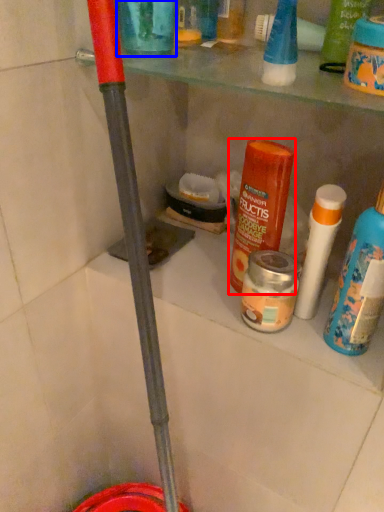
Question: Which point is closer to the camera, product (highlighted by a red box) or product (highlighted by a blue box)?

Choices:
 (A) product
 (B) product

Answer: (B)